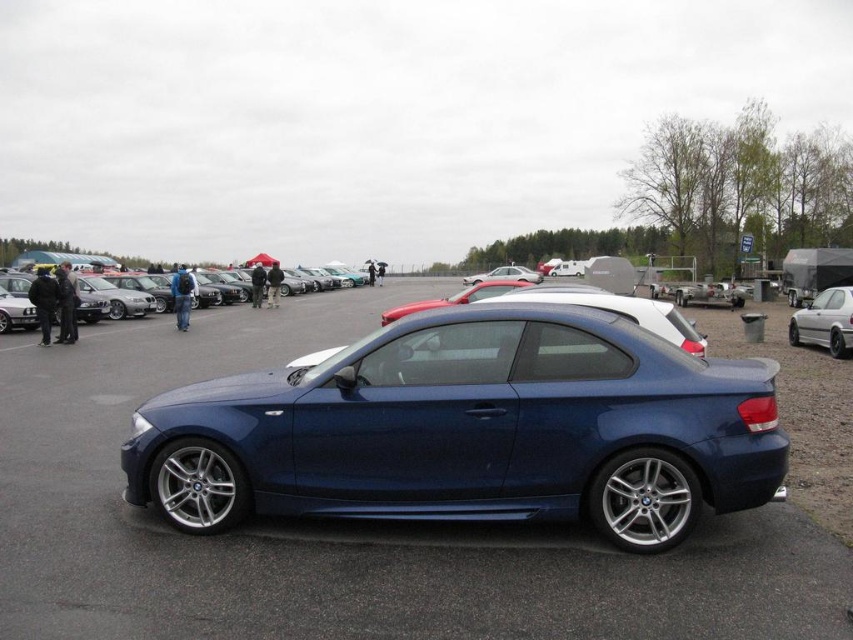
Question: In this image, where is metallic blue car at center located relative to matte black car at center?

Choices:
 (A) left
 (B) right

Answer: (B)

Question: Considering the relative positions of metallic blue car at center and matte black car at center in the image provided, where is metallic blue car at center located with respect to matte black car at center?

Choices:
 (A) left
 (B) right

Answer: (B)

Question: Which of the following is the farthest from the observer?

Choices:
 (A) (233, 298)
 (B) (824, 342)
 (C) (573, 637)

Answer: (A)

Question: Which of these objects is positioned closest to the white matte sedan at right?

Choices:
 (A) matte black car at center
 (B) metallic blue car at center

Answer: (B)

Question: Does metallic blue car at center have a larger size compared to matte black car at center?

Choices:
 (A) no
 (B) yes

Answer: (A)

Question: Which point is closer to the camera taking this photo?

Choices:
 (A) (827, 321)
 (B) (227, 288)
 (C) (439, 554)

Answer: (C)